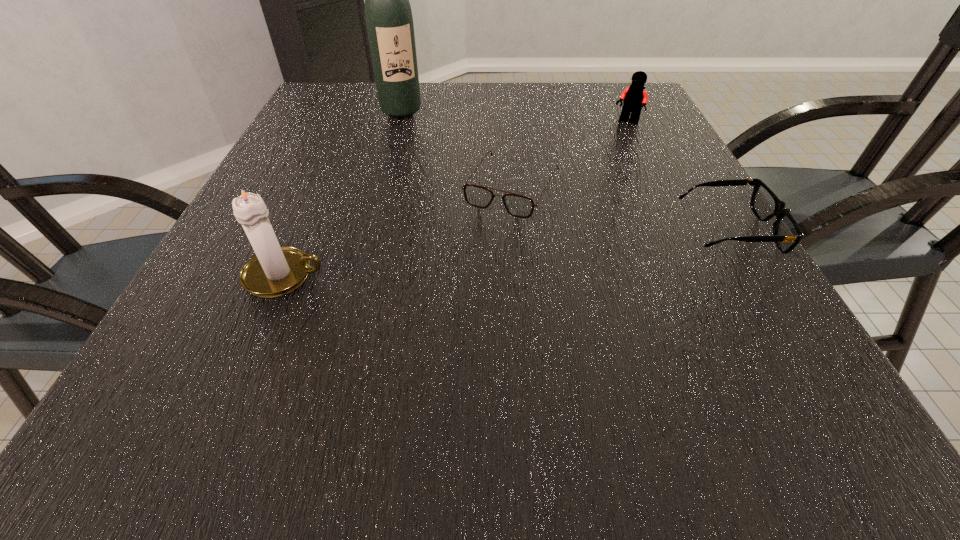
Identify the location of free space located on the front-facing side of the third shortest object. (585, 171).

At what (x,y) coordinates should I click in order to perform the action: click on vacant space situated 0.140m on the labeled side of the wine bottle. Please return your answer as a coordinate pair (x, y). Looking at the image, I should click on (419, 147).

In order to click on free location located 0.110m on the labeled side of the wine bottle in this screenshot , I will do `click(416, 141)`.

Identify the location of free space located on the labeled side of the wine bottle. This screenshot has width=960, height=540. (422, 154).

Image resolution: width=960 pixels, height=540 pixels. What are the coordinates of `free space located 0.210m on the front-facing side of the third object from left to right` in the screenshot? It's located at pyautogui.click(x=449, y=295).

Find the location of a particular element. This screenshot has width=960, height=540. free point located on the front-facing side of the third object from left to right is located at coordinates (452, 291).

Locate an element on the screen. The height and width of the screenshot is (540, 960). free region located 0.160m on the front-facing side of the third object from left to right is located at coordinates (462, 275).

The image size is (960, 540). Find the location of `Lego located at the far edge`. Lego located at the far edge is located at coordinates (634, 96).

At what (x,y) coordinates should I click in order to perform the action: click on wine bottle located at the far edge. Please return your answer as a coordinate pair (x, y). Looking at the image, I should click on (389, 21).

Where is `object present at the left edge`? object present at the left edge is located at coordinates (274, 271).